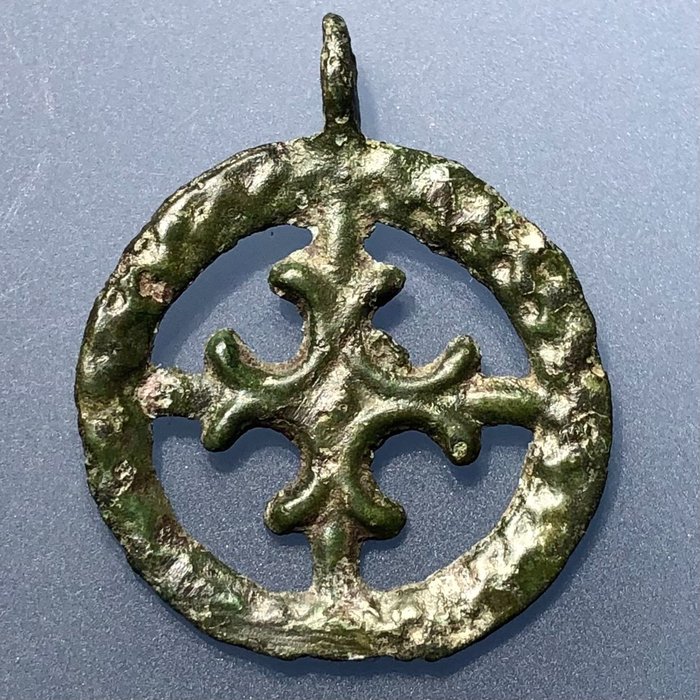
What are the coordinates of `table` in the screenshot? It's located at (622, 172).